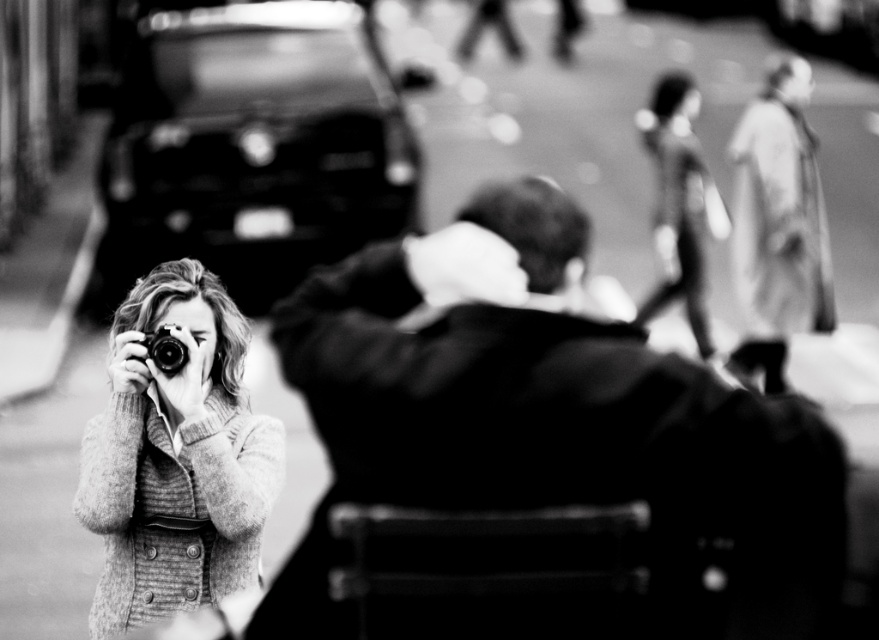
You are a photographer trying to adjust your focus. You notice the knitted sweater at left and the metallic silver camera at center in your viewfinder. Which object should you focus on to ensure the subject of the photo is sharp?

The knitted sweater at left is closer to the viewer than the metallic silver camera at center, so focusing on the metallic silver camera at center will keep the subject sharp.

You are a photographer who wants to capture a wide shot of the scene. The shiny black car at upper left and the knitted sweater at left are both in your frame. Since you need to ensure both objects are fully visible, which object requires more horizontal space in your composition?

The shiny black car at upper left requires more horizontal space in your composition because its width is larger than the knitted sweater at left.

In the scene, you see a smooth leather jacket at center and a knitted sweater at left. Which object is positioned to the right of the other?

The smooth leather jacket at center is to the right of the knitted sweater at left.